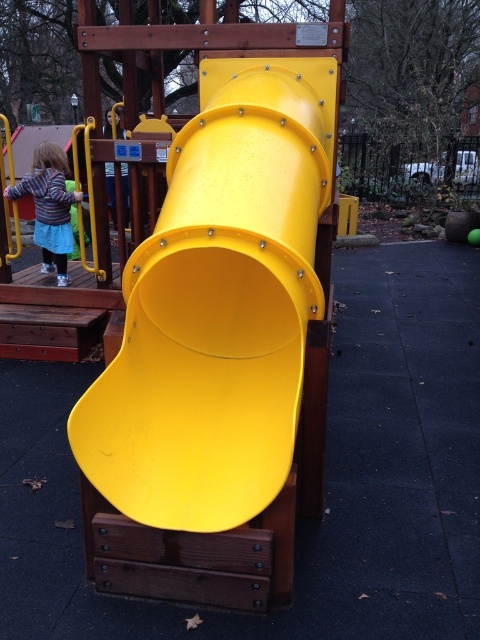
Question: From the image, what is the correct spatial relationship of yellow matte slide at center in relation to striped wool sweater at left?

Choices:
 (A) right
 (B) left

Answer: (A)

Question: Which point is closer to the camera?

Choices:
 (A) (36, 156)
 (B) (120, 472)

Answer: (B)

Question: Where is yellow matte slide at center located in relation to striped wool sweater at left in the image?

Choices:
 (A) left
 (B) right

Answer: (B)

Question: Which object appears farthest from the camera in this image?

Choices:
 (A) yellow matte slide at center
 (B) striped wool sweater at left

Answer: (B)

Question: Is yellow matte slide at center positioned in front of striped wool sweater at left?

Choices:
 (A) no
 (B) yes

Answer: (B)